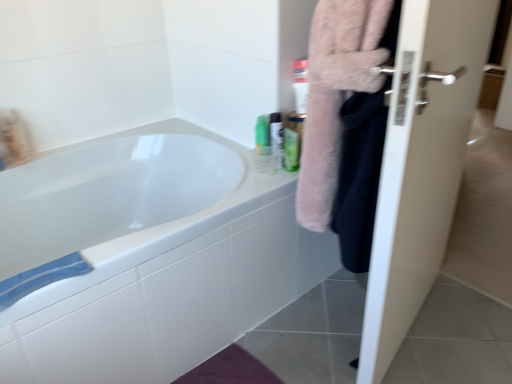
Question: Which is correct: white glossy door at right is inside white glossy mouthwash at upper right, acting as the 2th mouthwash starting from the right, or outside of it?

Choices:
 (A) inside
 (B) outside

Answer: (B)

Question: Considering the positions of white glossy door at right and white glossy mouthwash at upper right, acting as the 2th mouthwash starting from the right, in the image, is white glossy door at right bigger or smaller than white glossy mouthwash at upper right, acting as the 2th mouthwash starting from the right,?

Choices:
 (A) small
 (B) big

Answer: (B)

Question: Which of these objects is positioned farthest from the white glossy door at right?

Choices:
 (A) translucent plastic mouthwash at upper left, acting as the fourth mouthwash starting from the right
 (B) green matte bottle at upper right, the first mouthwash from the right
 (C) green plastic bottle at upper right, placed as the third mouthwash when sorted from right to left
 (D) white glossy mouthwash at upper right, acting as the 2th mouthwash starting from the right
 (E) blue cotton towel at lower left, marked as the second bath towel in a top-to-bottom arrangement

Answer: (A)

Question: Which of these objects is positioned farthest from the blue cotton towel at lower left, placed as the 2th bath towel when sorted from right to left?

Choices:
 (A) green plastic bottle at upper right, placed as the third mouthwash when sorted from right to left
 (B) fluffy pink towel at right, which is the 2th bath towel from left to right
 (C) white glossy bathtub at upper left
 (D) translucent plastic mouthwash at upper left, arranged as the first mouthwash when viewed from the left
 (E) green matte bottle at upper right, the first mouthwash from the right

Answer: (E)